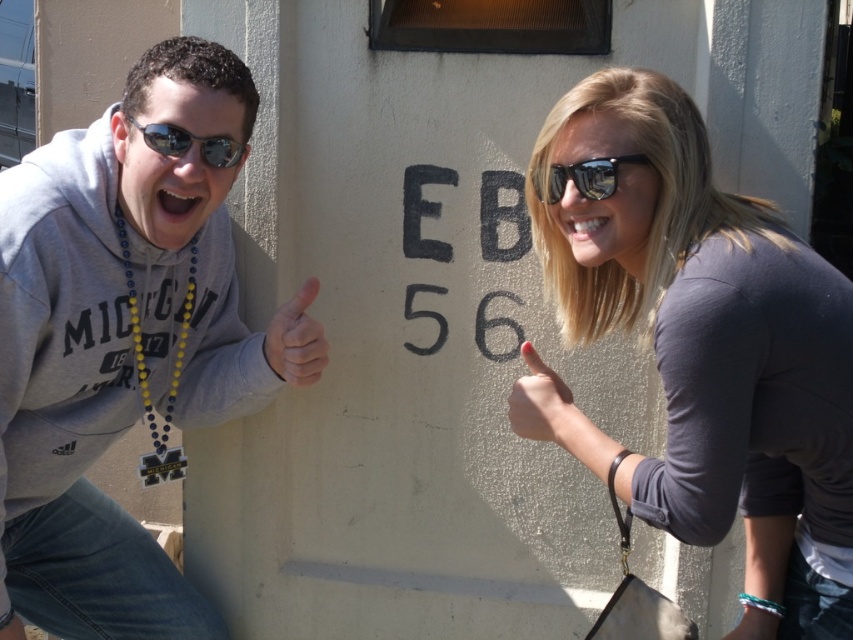
Is matte gray hand at center closer to camera compared to reflective plastic sunglasses at upper right?

That is False.

Is point (268, 348) positioned in front of point (537, 186)?

That is False.

The height and width of the screenshot is (640, 853). Find the location of `matte gray hand at center`. matte gray hand at center is located at coordinates [x=296, y=339].

Does gray sweatshirt at left have a larger size compared to reflective plastic sunglasses at upper right?

Correct, gray sweatshirt at left is larger in size than reflective plastic sunglasses at upper right.

Can you confirm if gray sweatshirt at left is smaller than reflective plastic sunglasses at upper right?

Actually, gray sweatshirt at left might be larger than reflective plastic sunglasses at upper right.

What do you see at coordinates (115, 342) in the screenshot? This screenshot has height=640, width=853. I see `gray sweatshirt at left` at bounding box center [115, 342].

The height and width of the screenshot is (640, 853). I want to click on gray sweatshirt at left, so click(115, 342).

Between point (555, 403) and point (155, 138), which one is positioned behind?

Point (155, 138)

Between point (567, 426) and point (186, 148), which one is positioned in front?

Point (567, 426) is in front.

Identify the location of matte skin at center. The width and height of the screenshot is (853, 640). (543, 404).

Identify the location of matte skin at center. (543, 404).